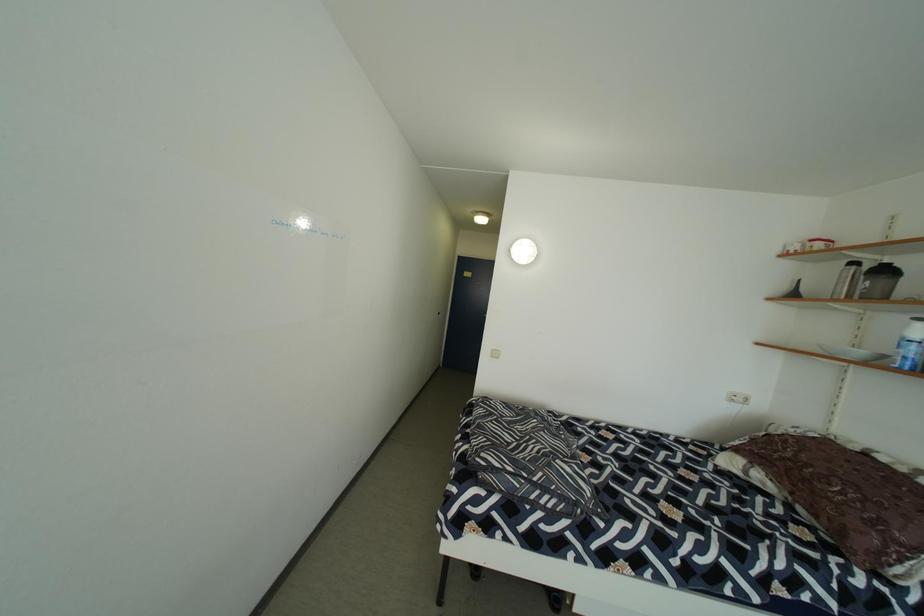
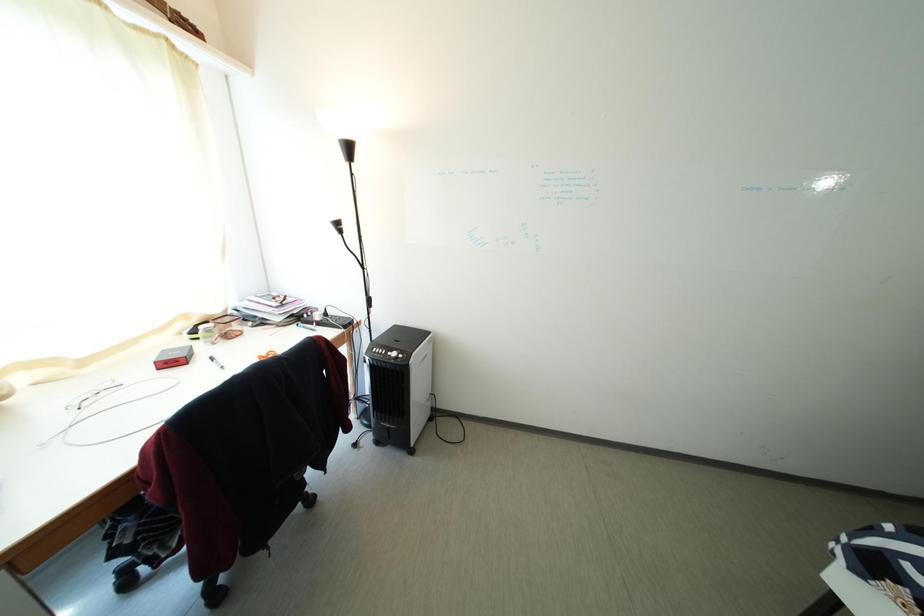
Question: The camera is either moving clockwise (left) or counter-clockwise (right) around the object. The first image is from the beginning of the video and the second image is from the end. Is the camera moving left or right when shooting the video?

Choices:
 (A) Left
 (B) Right

Answer: (B)